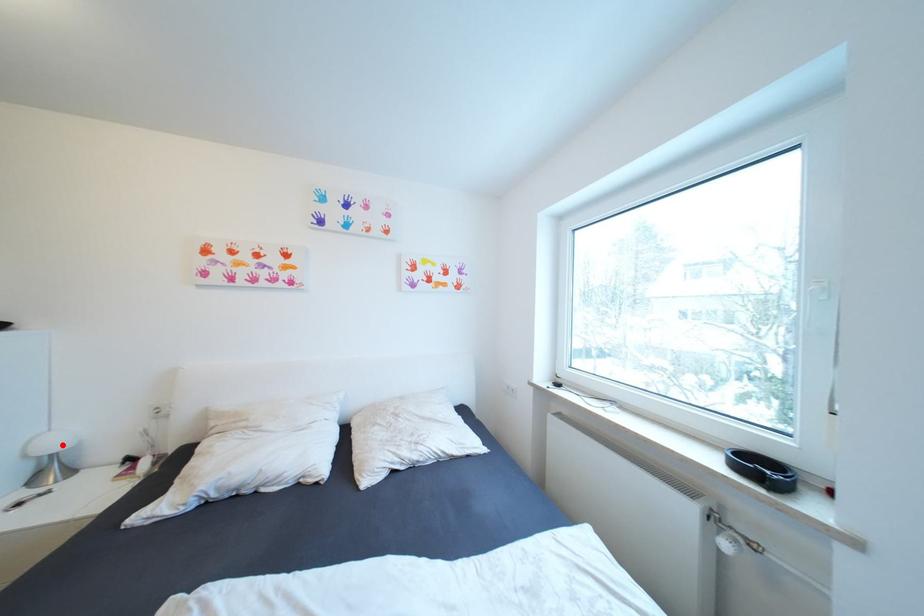
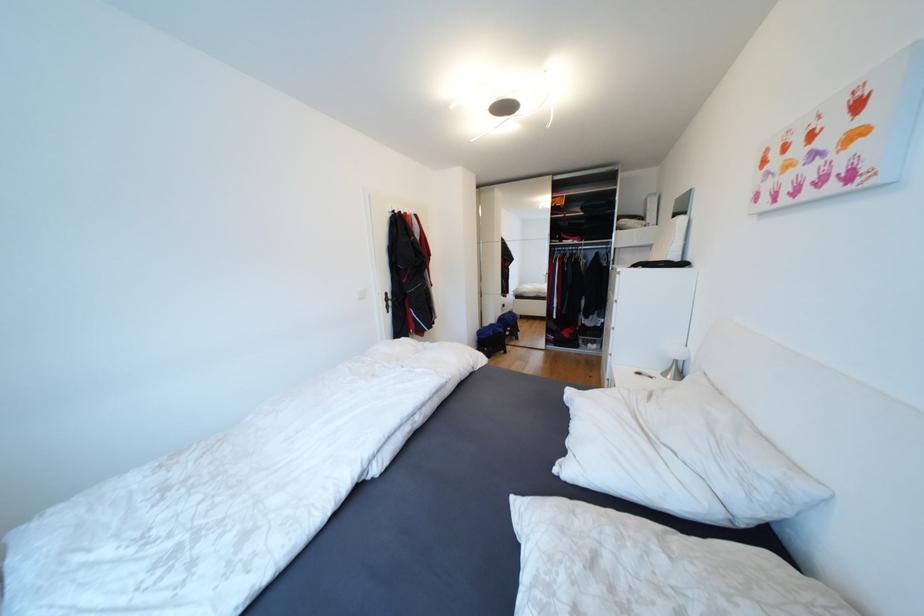
In the second image, find the point that corresponds to the highlighted location in the first image.

(682, 354)